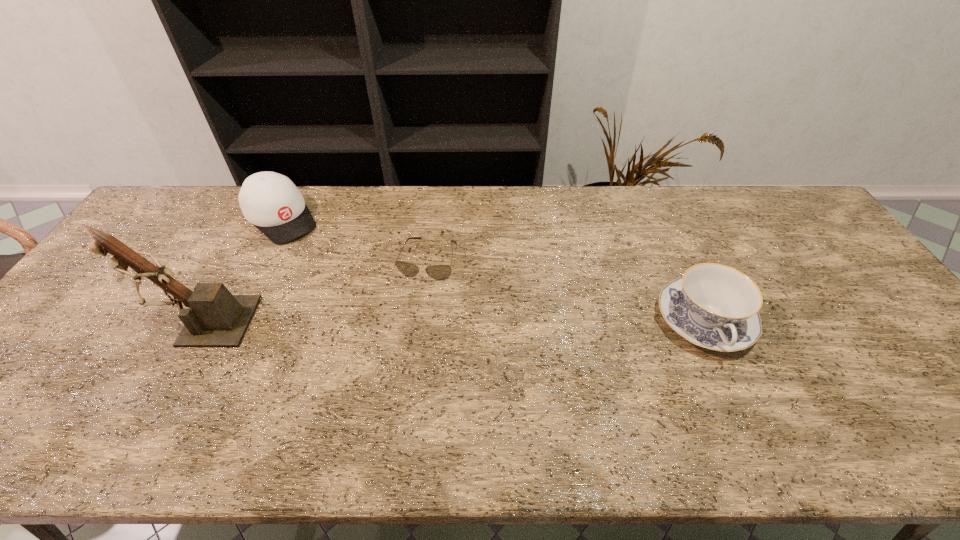
Where is `vacant area at the near right corner`? This screenshot has height=540, width=960. vacant area at the near right corner is located at coordinates (937, 408).

Identify the location of vacant region between the tallest object and the sunglasses. This screenshot has height=540, width=960. 314,290.

The image size is (960, 540). What are the coordinates of `free spot between the baseball cap and the rightmost object` in the screenshot? It's located at (493, 271).

Find the location of a particular element. Image resolution: width=960 pixels, height=540 pixels. free space between the rightmost object and the shortest object is located at coordinates (566, 290).

You are a GUI agent. You are given a task and a screenshot of the screen. Output one action in this format:
    pyautogui.click(x=<x>, y=<y>)
    Task: Click on the unoccupied position between the rightmost object and the baseball cap
    The image size is (960, 540).
    Given the screenshot: What is the action you would take?
    (x=493, y=271)

Identify the location of free space between the tallest object and the baseball cap. Image resolution: width=960 pixels, height=540 pixels. (241, 270).

Where is `empty space that is in between the third object from left to right and the baseball cap`? The width and height of the screenshot is (960, 540). empty space that is in between the third object from left to right and the baseball cap is located at coordinates (355, 239).

The image size is (960, 540). What are the coordinates of `empty space that is in between the baseball cap and the chinaware` in the screenshot? It's located at (493, 271).

Find the location of `free point between the baseball cap and the figurine`. free point between the baseball cap and the figurine is located at coordinates (241, 270).

In order to click on vacant area between the tallest object and the baseball cap in this screenshot , I will do `click(241, 270)`.